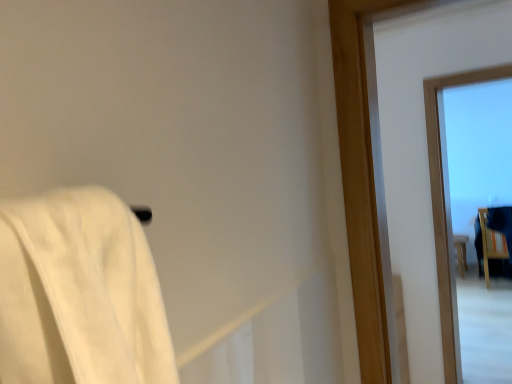
Question: From a real-world perspective, does wooden stool at right, which is the 1th furniture in back-to-front order, sit lower than transparent glass window at upper right?

Choices:
 (A) no
 (B) yes

Answer: (B)

Question: Considering the relative sizes of wooden stool at right, which is the 1th furniture in back-to-front order, and transparent glass window at upper right in the image provided, is wooden stool at right, which is the 1th furniture in back-to-front order, smaller than transparent glass window at upper right?

Choices:
 (A) no
 (B) yes

Answer: (B)

Question: Can you confirm if wooden stool at right, which is the 1th furniture in back-to-front order, is positioned to the right of transparent glass window at upper right?

Choices:
 (A) yes
 (B) no

Answer: (A)

Question: From the image's perspective, is wooden stool at right, which is the 1th furniture in back-to-front order, under transparent glass window at upper right?

Choices:
 (A) no
 (B) yes

Answer: (B)

Question: From a real-world perspective, is wooden stool at right, which is the 1th furniture in back-to-front order, on top of transparent glass window at upper right?

Choices:
 (A) no
 (B) yes

Answer: (A)

Question: Does wooden stool at right, placed as the second furniture when sorted from front to back, have a greater height compared to transparent glass window at upper right?

Choices:
 (A) no
 (B) yes

Answer: (A)

Question: Is the depth of transparent glass window at upper right less than that of wooden stool at right, placed as the second furniture when sorted from front to back?

Choices:
 (A) no
 (B) yes

Answer: (B)

Question: From a real-world perspective, is transparent glass window at upper right under wooden stool at right, placed as the second furniture when sorted from front to back?

Choices:
 (A) yes
 (B) no

Answer: (B)

Question: Does transparent glass window at upper right contain wooden stool at right, which is the 1th furniture in back-to-front order?

Choices:
 (A) yes
 (B) no

Answer: (B)

Question: Is transparent glass window at upper right oriented away from wooden stool at right, which is the 1th furniture in back-to-front order?

Choices:
 (A) yes
 (B) no

Answer: (A)

Question: Does transparent glass window at upper right have a lesser height compared to wooden stool at right, placed as the second furniture when sorted from front to back?

Choices:
 (A) yes
 (B) no

Answer: (B)

Question: From the image's perspective, is transparent glass window at upper right beneath wooden stool at right, placed as the second furniture when sorted from front to back?

Choices:
 (A) no
 (B) yes

Answer: (A)

Question: Is transparent glass window at upper right shorter than wooden chair at right, which is the second furniture from back to front?

Choices:
 (A) no
 (B) yes

Answer: (A)